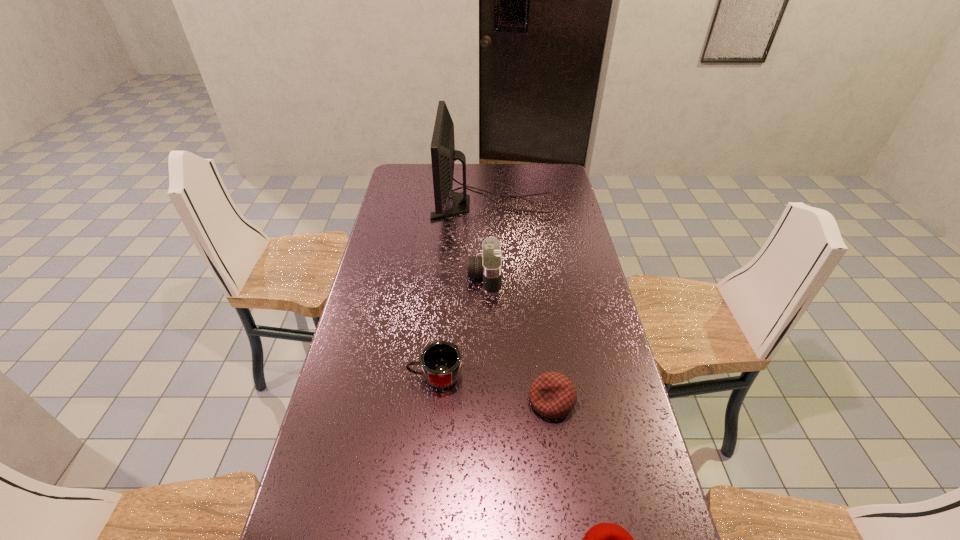
Locate an element on the screen. computer monitor is located at coordinates (443, 154).

What are the coordinates of `the farthest object` in the screenshot? It's located at (443, 154).

The image size is (960, 540). Find the location of `camera`. camera is located at coordinates (489, 266).

Find the location of `the second farthest object`. the second farthest object is located at coordinates (x=489, y=266).

This screenshot has width=960, height=540. Identify the location of mug. (441, 362).

Where is `the farther beanbag`? This screenshot has height=540, width=960. the farther beanbag is located at coordinates (553, 395).

This screenshot has width=960, height=540. I want to click on vacant region located on the screen side of the computer monitor, so click(x=396, y=205).

Locate an element on the screen. This screenshot has height=540, width=960. vacant region located 0.170m on the screen side of the computer monitor is located at coordinates (394, 205).

Find the location of a particular element. The image size is (960, 540). vacant space located 0.090m on the screen side of the computer monitor is located at coordinates (412, 205).

Find the location of a particular element. Image resolution: width=960 pixels, height=540 pixels. vacant area situated 0.170m on the front-facing side of the camera is located at coordinates (420, 276).